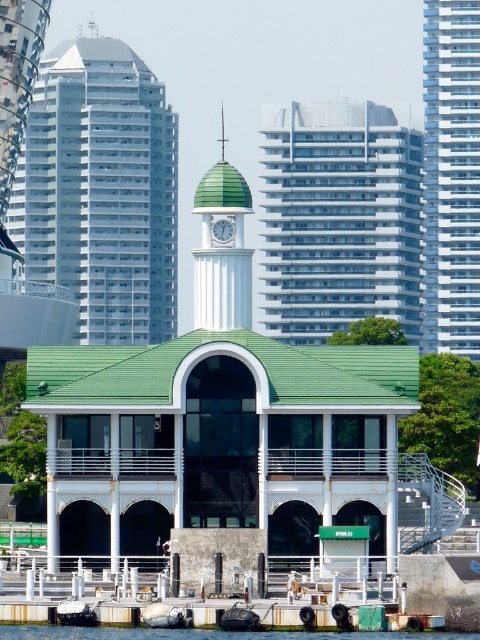
Question: Is the position of white rubber boat at lower center more distant than that of white plastic clock at center?

Choices:
 (A) no
 (B) yes

Answer: (A)

Question: Which point is closer to the camera?

Choices:
 (A) white smooth clock tower at center
 (B) white glass building at center
 (C) black rubber boat at lower center

Answer: (C)

Question: Can you confirm if white glass clock tower at upper center is positioned above white smooth clock tower at center?

Choices:
 (A) no
 (B) yes

Answer: (B)

Question: Does white glass clock tower at upper center have a smaller size compared to white glass tower at right?

Choices:
 (A) no
 (B) yes

Answer: (A)

Question: Which object is farther from the camera taking this photo?

Choices:
 (A) white rubber boat at lower center
 (B) white glass tower at right
 (C) transparent plastic water at lower center

Answer: (B)

Question: Which point appears closest to the camera in this image?

Choices:
 (A) (215, 240)
 (B) (187, 611)
 (C) (312, 164)

Answer: (B)